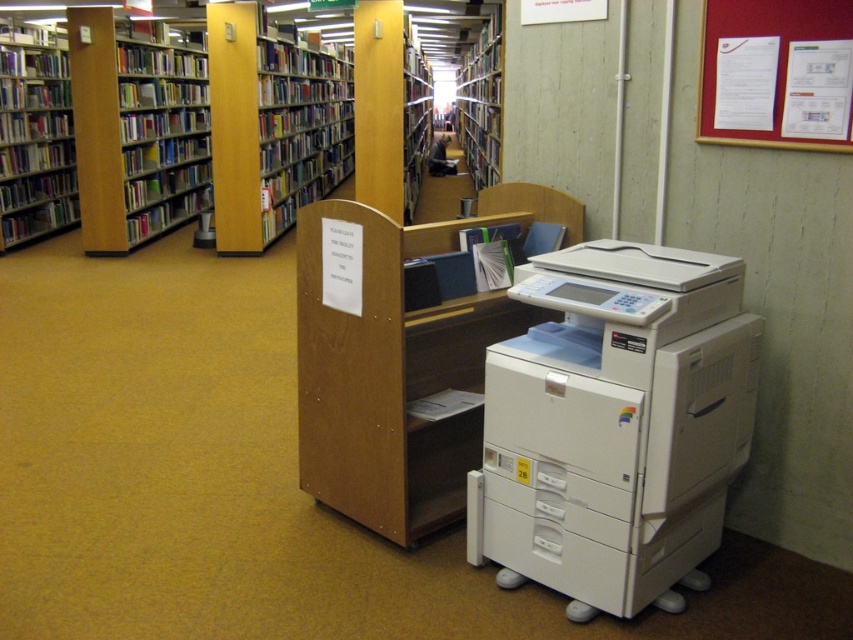
Which is above, wooden bookcase at left or white paper at upper right?

Positioned higher is wooden bookcase at left.

Is wooden bookcase at left below white paper at upper right?

No.

Is point (109, 33) less distant than point (825, 4)?

No, (109, 33) is behind (825, 4).

Image resolution: width=853 pixels, height=640 pixels. What are the coordinates of `wooden bookcase at left` in the screenshot? It's located at (136, 131).

Looking at this image, how much distance is there between white plastic printer at lower right and wooden bookcase at left?

The distance of white plastic printer at lower right from wooden bookcase at left is 21.60 feet.

Is point (688, 376) more distant than point (111, 216)?

That is False.

Between point (666, 456) and point (189, 83), which one is positioned in front?

Point (666, 456) is more forward.

Image resolution: width=853 pixels, height=640 pixels. What are the coordinates of `white plastic printer at lower right` in the screenshot? It's located at (614, 424).

Does wooden bookcase at left appear on the right side of wooden bookshelf at left?

Yes, wooden bookcase at left is to the right of wooden bookshelf at left.

Which of these two, wooden bookcase at left or wooden bookshelf at left, stands taller?

wooden bookcase at left is taller.

Which is in front, point (143, 177) or point (21, 241)?

Point (21, 241)

At what (x,y) coordinates should I click in order to perform the action: click on wooden bookcase at left. Please return your answer as a coordinate pair (x, y). Image resolution: width=853 pixels, height=640 pixels. Looking at the image, I should click on (136, 131).